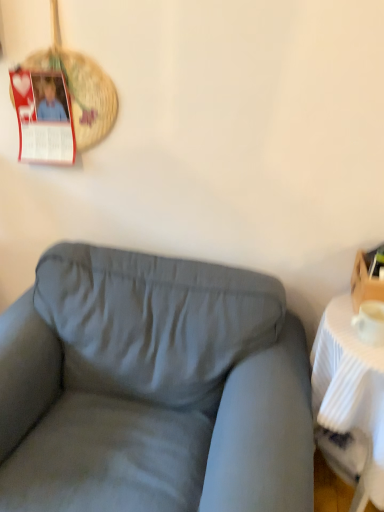
The image size is (384, 512). What do you see at coordinates (366, 280) in the screenshot?
I see `wooden box at right` at bounding box center [366, 280].

In order to click on woven straw basket at upper left in this screenshot , I will do `click(81, 92)`.

From a real-world perspective, which object stands above the other?

woven straw basket at upper left, from a real-world perspective.

Who is more distant, white ribbed table at right or woven straw basket at upper left?

woven straw basket at upper left is more distant.

Is white ribbed table at right outside of woven straw basket at upper left?

Yes, white ribbed table at right is outside of woven straw basket at upper left.

From a real-world perspective, which object stands above the other?

woven straw basket at upper left is physically above.

Is woven straw basket at upper left oriented away from suede gray couch at center?

No, woven straw basket at upper left is not facing the opposite direction of suede gray couch at center.

Is woven straw basket at upper left smaller than suede gray couch at center?

Yes, woven straw basket at upper left is smaller than suede gray couch at center.

Consider the image. From the image's perspective, relative to suede gray couch at center, is woven straw basket at upper left above or below?

woven straw basket at upper left is situated higher than suede gray couch at center in the image.

Considering the positions of objects suede gray couch at center and woven straw basket at upper left in the image provided, who is in front, suede gray couch at center or woven straw basket at upper left?

suede gray couch at center.

Would you say suede gray couch at center is inside or outside woven straw basket at upper left?

The correct answer is: outside.

Is suede gray couch at center directly adjacent to woven straw basket at upper left?

No, suede gray couch at center is not with woven straw basket at upper left.

How different are the orientations of suede gray couch at center and woven straw basket at upper left in degrees?

suede gray couch at center and woven straw basket at upper left are facing 0.877 degrees away from each other.

This screenshot has width=384, height=512. I want to click on studio couch below the wooden box at right (from a real-world perspective), so click(152, 388).

Is suede gray couch at center shorter than wooden box at right?

In fact, suede gray couch at center may be taller than wooden box at right.

Is wooden box at right located within suede gray couch at center?

No, wooden box at right is not inside suede gray couch at center.

Based on the photo, is suede gray couch at center bigger or smaller than wooden box at right?

suede gray couch at center is bigger than wooden box at right.

Which object is positioned more to the left, white ribbed table at right or wooden box at right?

white ribbed table at right.

How different are the orientations of white ribbed table at right and wooden box at right in degrees?

The angular difference between white ribbed table at right and wooden box at right is 0.496 degrees.

In terms of width, does white ribbed table at right look wider or thinner when compared to wooden box at right?

In the image, white ribbed table at right appears to be wider than wooden box at right.

Based on the photo, which is correct: white ribbed table at right is inside wooden box at right, or outside of it?

white ribbed table at right is outside wooden box at right.

Considering the positions of objects wooden box at right and woven straw basket at upper left in the image provided, who is more to the left, wooden box at right or woven straw basket at upper left?

woven straw basket at upper left is more to the left.

Is wooden box at right aimed at woven straw basket at upper left?

No.

Does wooden box at right contain woven straw basket at upper left?

Definitely not — woven straw basket at upper left is not inside wooden box at right.

Is wooden box at right not close to woven straw basket at upper left?

Yes.

From the image's perspective, is suede gray couch at center under white ribbed table at right?

No.

From a real-world perspective, relative to white ribbed table at right, is suede gray couch at center vertically above or below?

suede gray couch at center is above white ribbed table at right.

Which is correct: suede gray couch at center is inside white ribbed table at right, or outside of it?

suede gray couch at center exists outside the volume of white ribbed table at right.

Looking at this image, considering the positions of objects suede gray couch at center and white ribbed table at right in the image provided, who is more to the right, suede gray couch at center or white ribbed table at right?

Positioned to the right is white ribbed table at right.

This screenshot has height=512, width=384. Identify the location of table that is on the right side of woven straw basket at upper left. 349,402.

You are a GUI agent. You are given a task and a screenshot of the screen. Output one action in this format:
    pyautogui.click(x=<x>, y=<y>)
    Task: Click on the basket behind the suede gray couch at center
    This screenshot has height=512, width=384.
    Given the screenshot: What is the action you would take?
    pyautogui.click(x=81, y=92)

Estimate the real-world distances between objects in this image. Which object is further from white ribbed table at right, suede gray couch at center or woven straw basket at upper left?

Among the two, woven straw basket at upper left is located further to white ribbed table at right.

When comparing their distances from wooden box at right, does woven straw basket at upper left or suede gray couch at center seem further?

Based on the image, woven straw basket at upper left appears to be further to wooden box at right.

Which object lies nearer to the anchor point white ribbed table at right, wooden box at right or suede gray couch at center?

wooden box at right lies closer to white ribbed table at right than the other object.

In the scene shown: Based on their spatial positions, is wooden box at right or woven straw basket at upper left further from suede gray couch at center?

woven straw basket at upper left lies further to suede gray couch at center than the other object.

When comparing their distances from woven straw basket at upper left, does wooden box at right or suede gray couch at center seem further?

wooden box at right.

Based on their spatial positions, is suede gray couch at center or woven straw basket at upper left closer to wooden box at right?

Among the two, suede gray couch at center is located nearer to wooden box at right.

Considering their positions, is suede gray couch at center positioned further to woven straw basket at upper left than white ribbed table at right?

Based on the image, white ribbed table at right appears to be further to woven straw basket at upper left.

Based on their spatial positions, is wooden box at right or woven straw basket at upper left closer to white ribbed table at right?

wooden box at right.

The image size is (384, 512). Find the location of `studio couch that lies between woven straw basket at upper left and white ribbed table at right from top to bottom`. studio couch that lies between woven straw basket at upper left and white ribbed table at right from top to bottom is located at coordinates (152, 388).

The image size is (384, 512). In order to click on box between woven straw basket at upper left and white ribbed table at right from top to bottom in this screenshot , I will do `click(366, 280)`.

What are the coordinates of `box between woven straw basket at upper left and suede gray couch at center in the up-down direction` in the screenshot? It's located at tap(366, 280).

At what (x,y) coordinates should I click in order to perform the action: click on table between suede gray couch at center and wooden box at right. Please return your answer as a coordinate pair (x, y). Looking at the image, I should click on (349, 402).